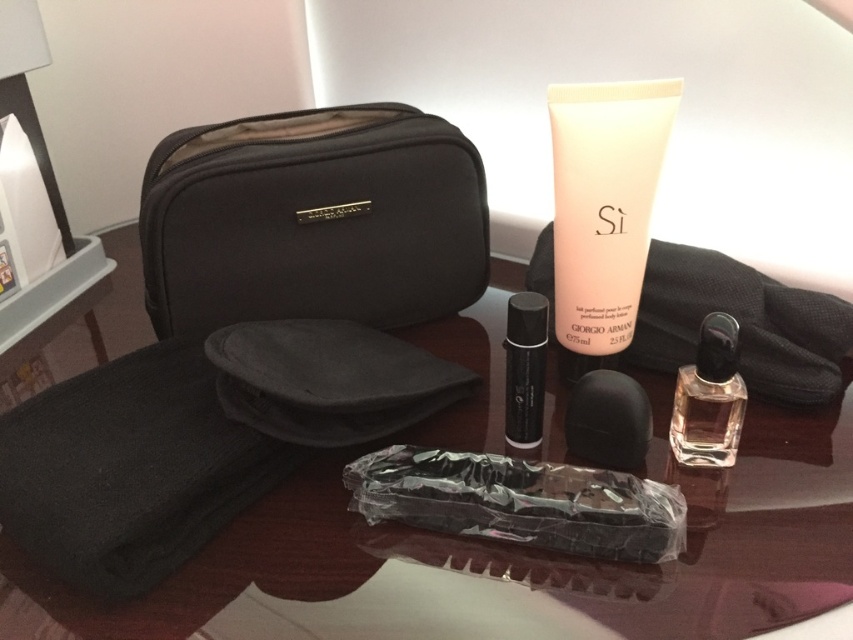
Does point (514, 273) come farther from viewer compared to point (553, 192)?

Yes, point (514, 273) is behind point (553, 192).

What are the coordinates of `transparent glass table at center` in the screenshot? It's located at click(x=764, y=540).

Between point (381, 596) and point (624, 308), which one is positioned behind?

Positioned behind is point (624, 308).

The width and height of the screenshot is (853, 640). Find the location of `transparent glass table at center`. transparent glass table at center is located at coordinates (764, 540).

Can you confirm if transparent glass table at center is positioned above black glass perfume at center?

Actually, transparent glass table at center is below black glass perfume at center.

Can you confirm if transparent glass table at center is positioned to the left of black glass perfume at center?

Correct, you'll find transparent glass table at center to the left of black glass perfume at center.

Which is behind, point (256, 584) or point (526, 436)?

The point (526, 436) is more distant.

You are a GUI agent. You are given a task and a screenshot of the screen. Output one action in this format:
    pyautogui.click(x=<x>, y=<y>)
    Task: Click on the transparent glass table at center
    
    Given the screenshot: What is the action you would take?
    pyautogui.click(x=764, y=540)

Does black fabric toiletry bag at upper left have a lesser height compared to clear glass perfume at center right?

No, black fabric toiletry bag at upper left is not shorter than clear glass perfume at center right.

Does black fabric toiletry bag at upper left have a lesser width compared to clear glass perfume at center right?

No, black fabric toiletry bag at upper left is not thinner than clear glass perfume at center right.

What do you see at coordinates (312, 220) in the screenshot? Image resolution: width=853 pixels, height=640 pixels. I see `black fabric toiletry bag at upper left` at bounding box center [312, 220].

Find the location of `black fabric toiletry bag at upper left`. black fabric toiletry bag at upper left is located at coordinates (312, 220).